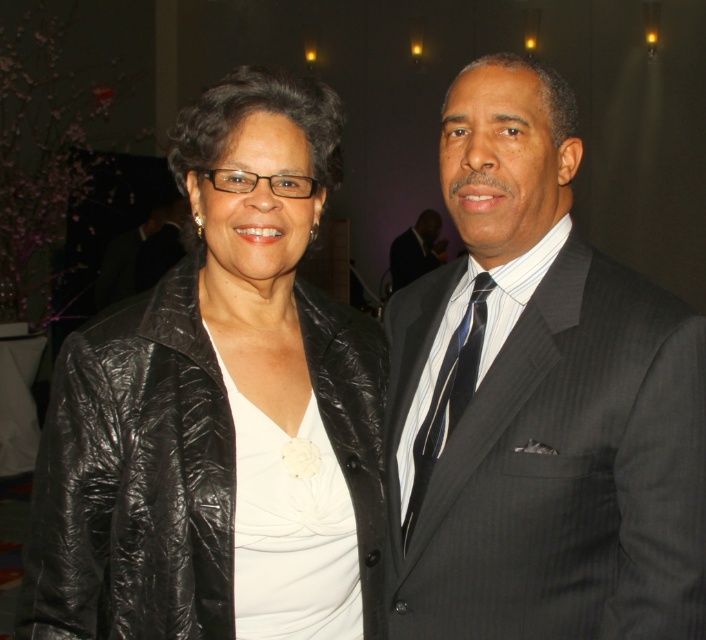
Measure the distance between dark gray pinstripe suit at right and striped silk tie at right.

5.17 inches

Does dark gray pinstripe suit at right have a smaller size compared to striped silk tie at right?

Incorrect, dark gray pinstripe suit at right is not smaller in size than striped silk tie at right.

Between point (638, 340) and point (443, 424), which one is positioned behind?

Point (443, 424)

Where is `dark gray pinstripe suit at right`? The height and width of the screenshot is (640, 706). dark gray pinstripe suit at right is located at coordinates (538, 401).

Measure the distance between black leather jacket at left and dark suit at center.

5.93 meters

Who is positioned more to the right, black leather jacket at left or dark suit at center?

From the viewer's perspective, dark suit at center appears more on the right side.

Image resolution: width=706 pixels, height=640 pixels. Identify the location of black leather jacket at left. (220, 412).

Can you confirm if black leather jacket at left is taller than striped silk tie at right?

Correct, black leather jacket at left is much taller as striped silk tie at right.

The width and height of the screenshot is (706, 640). What do you see at coordinates (220, 412) in the screenshot? I see `black leather jacket at left` at bounding box center [220, 412].

At what (x,y) coordinates should I click in order to perform the action: click on black leather jacket at left. Please return your answer as a coordinate pair (x, y). Looking at the image, I should click on (220, 412).